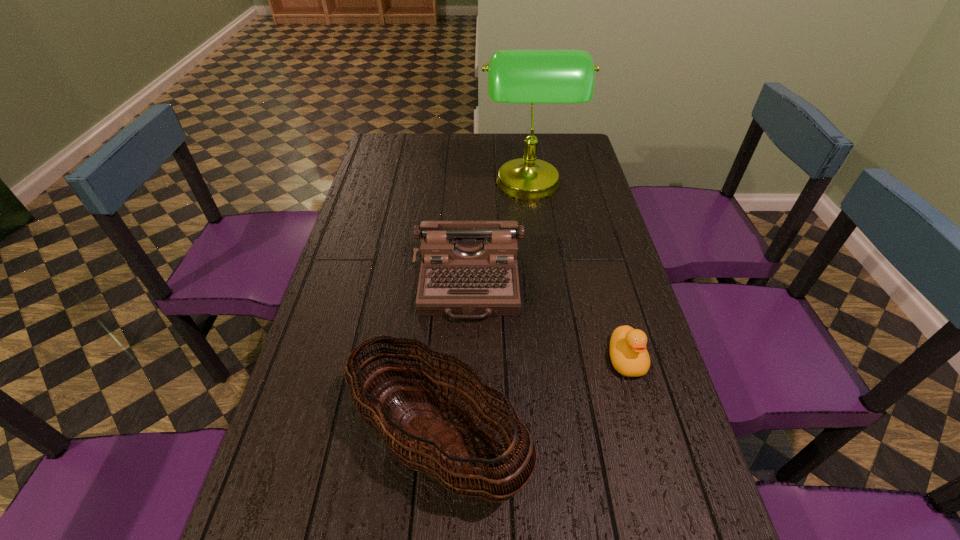
Where is `vacant space located 0.390m on the keyboard of the third nearest object`? The image size is (960, 540). vacant space located 0.390m on the keyboard of the third nearest object is located at coordinates (464, 474).

At what (x,y) coordinates should I click in order to perform the action: click on vacant space located 0.270m on the face of the shortest object. Please return your answer as a coordinate pair (x, y). Looking at the image, I should click on (666, 503).

The width and height of the screenshot is (960, 540). I want to click on object located in the left edge section of the desktop, so click(x=432, y=441).

Find the location of a particular element. lamp that is at the right edge is located at coordinates (514, 76).

Where is `duck that is at the right edge`? The image size is (960, 540). duck that is at the right edge is located at coordinates (628, 353).

Locate an element on the screen. The image size is (960, 540). free spot at the left edge of the desktop is located at coordinates (377, 215).

Locate an element on the screen. This screenshot has width=960, height=540. free space at the right edge is located at coordinates (568, 181).

Find the location of a particular element. The image size is (960, 540). vacant space at the far left corner of the desktop is located at coordinates (414, 136).

Identify the location of blank region between the lamp and the duck. The height and width of the screenshot is (540, 960). (577, 273).

Image resolution: width=960 pixels, height=540 pixels. In order to click on empty location between the shortest object and the second tallest object in this screenshot , I will do `click(533, 401)`.